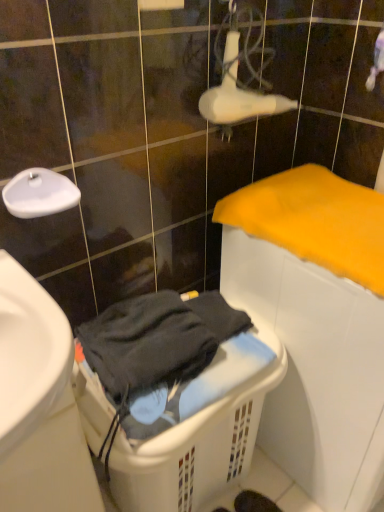
Question: Is white plastic laundry basket at lower center located outside white glossy faucet at upper left?

Choices:
 (A) yes
 (B) no

Answer: (A)

Question: From the image's perspective, is white plastic laundry basket at lower center below white glossy faucet at upper left?

Choices:
 (A) no
 (B) yes

Answer: (B)

Question: Is white plastic laundry basket at lower center facing towards white glossy faucet at upper left?

Choices:
 (A) no
 (B) yes

Answer: (A)

Question: Considering the relative sizes of white plastic laundry basket at lower center and white glossy faucet at upper left in the image provided, is white plastic laundry basket at lower center shorter than white glossy faucet at upper left?

Choices:
 (A) yes
 (B) no

Answer: (B)

Question: Is white plastic laundry basket at lower center taller than white glossy faucet at upper left?

Choices:
 (A) no
 (B) yes

Answer: (B)

Question: Is yellow soft cloth at right wider or thinner than white glossy faucet at upper left?

Choices:
 (A) wide
 (B) thin

Answer: (A)

Question: Considering their positions, is yellow soft cloth at right located in front of or behind white glossy faucet at upper left?

Choices:
 (A) front
 (B) behind

Answer: (A)

Question: From the image's perspective, is yellow soft cloth at right located above or below white glossy faucet at upper left?

Choices:
 (A) below
 (B) above

Answer: (A)

Question: Is point (301, 244) closer or farther from the camera than point (34, 187)?

Choices:
 (A) farther
 (B) closer

Answer: (A)

Question: In terms of height, does white glossy faucet at upper left look taller or shorter compared to white plastic laundry basket at lower center?

Choices:
 (A) tall
 (B) short

Answer: (B)

Question: Visually, is white glossy faucet at upper left positioned to the left or to the right of white plastic laundry basket at lower center?

Choices:
 (A) left
 (B) right

Answer: (A)

Question: From the image's perspective, relative to white plastic laundry basket at lower center, is white glossy faucet at upper left above or below?

Choices:
 (A) below
 (B) above

Answer: (B)

Question: Would you say white glossy faucet at upper left is inside or outside white plastic laundry basket at lower center?

Choices:
 (A) outside
 (B) inside

Answer: (A)

Question: Considering the positions of white plastic laundry basket at lower center and yellow soft cloth at right in the image, is white plastic laundry basket at lower center wider or thinner than yellow soft cloth at right?

Choices:
 (A) thin
 (B) wide

Answer: (A)

Question: Is white plastic laundry basket at lower center bigger or smaller than yellow soft cloth at right?

Choices:
 (A) small
 (B) big

Answer: (B)